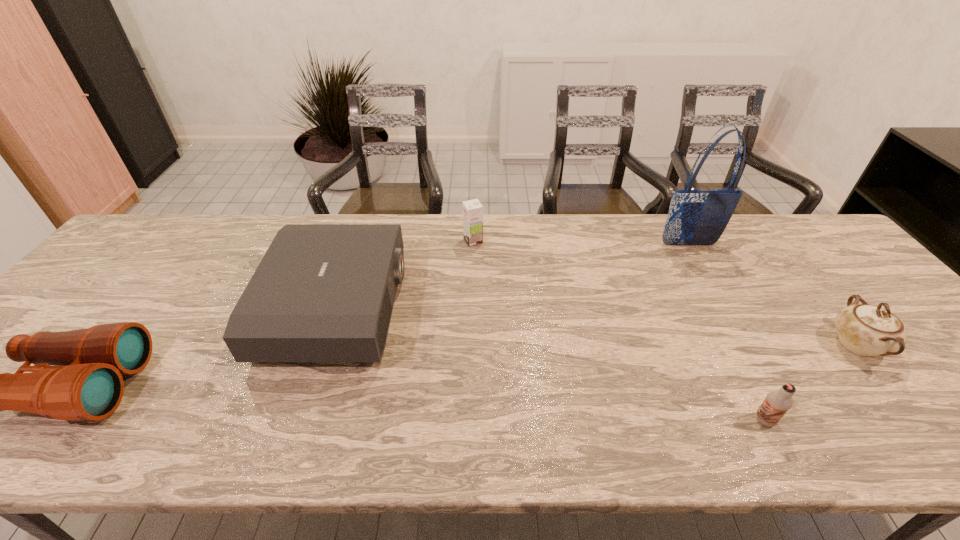
Locate an element on the screen. Image resolution: width=960 pixels, height=540 pixels. free location that satisfies the following two spatial constraints: 1. on the front-facing side of the shopping bag; 2. on the front-facing side of the fifth object from right to left is located at coordinates (724, 307).

You are a GUI agent. You are given a task and a screenshot of the screen. Output one action in this format:
    pyautogui.click(x=<x>, y=<y>)
    Task: Click on the vacant area that satisfies the following two spatial constraints: 1. on the front-facing side of the shopping bag; 2. on the front-facing side of the projector
    The width and height of the screenshot is (960, 540).
    Given the screenshot: What is the action you would take?
    pyautogui.click(x=724, y=307)

This screenshot has height=540, width=960. Find the location of `vacant region that satisfies the following two spatial constraints: 1. on the front-facing side of the shopping bag; 2. on the front-facing side of the projector`. vacant region that satisfies the following two spatial constraints: 1. on the front-facing side of the shopping bag; 2. on the front-facing side of the projector is located at coordinates (724, 307).

Identify the location of vacant space that satisfies the following two spatial constraints: 1. on the front side of the fourth object from right to left; 2. on the front-facing side of the projector. This screenshot has height=540, width=960. pos(472,307).

Locate an element on the screen. This screenshot has width=960, height=540. free point that satisfies the following two spatial constraints: 1. on the front-facing side of the tallest object; 2. on the left side of the rightmost object is located at coordinates (745, 344).

You are a GUI agent. You are given a task and a screenshot of the screen. Output one action in this format:
    pyautogui.click(x=<x>, y=<y>)
    Task: Click on the free space that satisfies the following two spatial constraints: 1. on the front side of the taller chocolate milk; 2. on the left side of the right chocolate milk
    This screenshot has width=960, height=540.
    Given the screenshot: What is the action you would take?
    pyautogui.click(x=469, y=420)